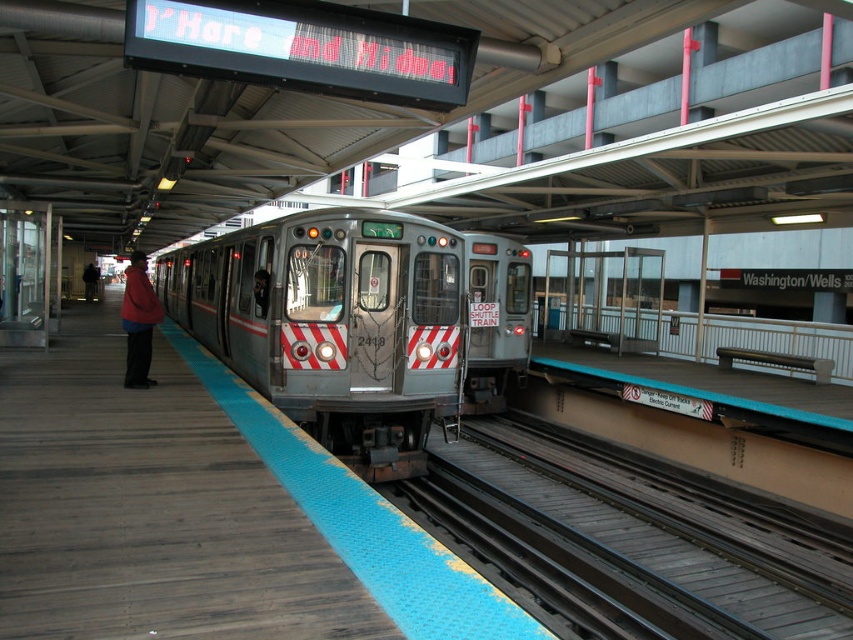
A maintenance worker needs to cross between the black metal train track at lower center and the Loop Shuttle Train. Given that the worker is 1.8 meters tall, can they safely walk through the gap without ducking or bending?

The gap between the black metal train track at lower center and the Loop Shuttle Train is 5.02 meters, which is wider than the worker. The worker can safely walk through without needing to duck or bend.

You are standing on the wooden platform at center and want to board the silver metallic train at center. Which direction should you walk to reach the train?

Since the wooden platform at center is closer to the viewer than the silver metallic train at center, you should walk forward towards the train to reach it.

You are a passenger standing on the wooden platform at center. You want to board the silver metallic train at center. Can you walk directly to the train without stepping off the platform?

The wooden platform at center is narrower than the silver metallic train at center, so you can walk directly to the train without stepping off the platform because the platform extends sufficiently to allow access.